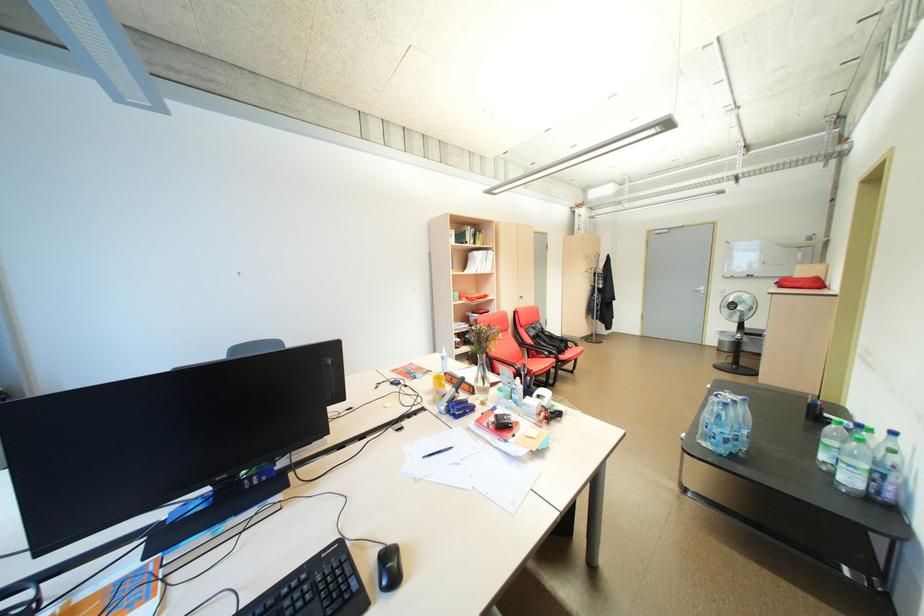
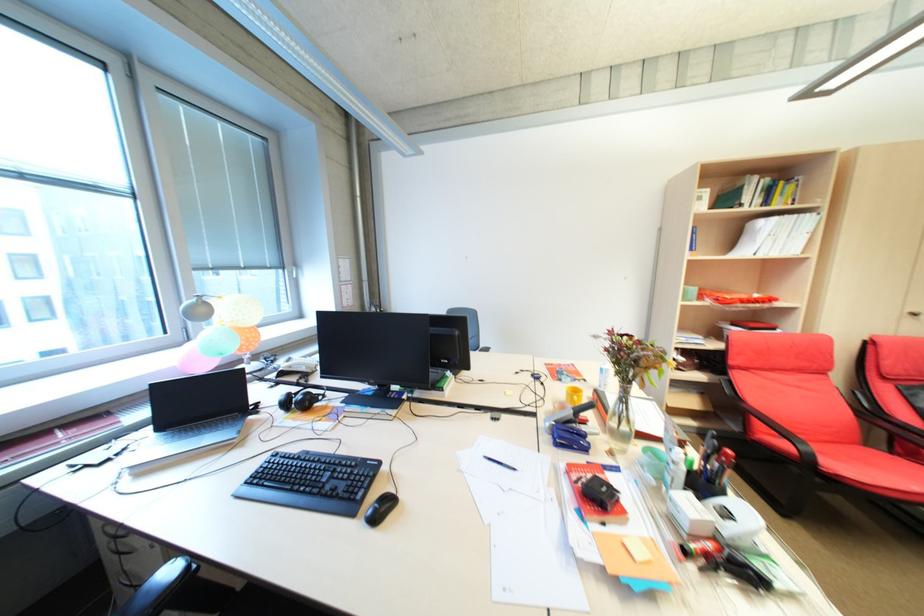
Question: Based on the continuous images, in which direction is the camera rotating? Reply with the corresponding letter.

Choices:
 (A) Left
 (B) Right
 (C) Up
 (D) Down

Answer: (A)